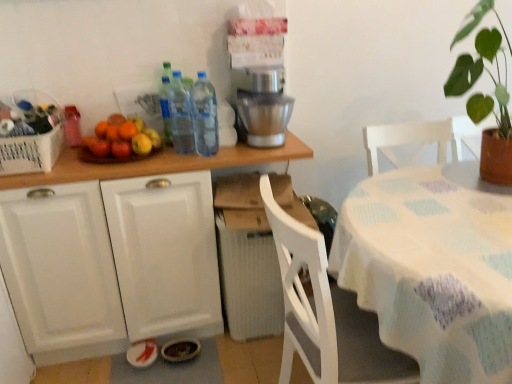
Question: Considering the relative positions of satin silver coffee machine at upper center and translucent plastic bottles at upper center, marked as the second bottle in a right-to-left arrangement, in the image provided, is satin silver coffee machine at upper center in front of translucent plastic bottles at upper center, marked as the second bottle in a right-to-left arrangement,?

Choices:
 (A) yes
 (B) no

Answer: (B)

Question: From a real-world perspective, does satin silver coffee machine at upper center stand above translucent plastic bottles at upper center, which is the second bottle in left-to-right order?

Choices:
 (A) yes
 (B) no

Answer: (B)

Question: Considering the relative positions of satin silver coffee machine at upper center and translucent plastic bottles at upper center, marked as the second bottle in a right-to-left arrangement, in the image provided, is satin silver coffee machine at upper center to the left of translucent plastic bottles at upper center, marked as the second bottle in a right-to-left arrangement, from the viewer's perspective?

Choices:
 (A) yes
 (B) no

Answer: (B)

Question: Is satin silver coffee machine at upper center wider than translucent plastic bottles at upper center, marked as the second bottle in a right-to-left arrangement?

Choices:
 (A) yes
 (B) no

Answer: (A)

Question: Would you say satin silver coffee machine at upper center is a long distance from translucent plastic bottles at upper center, which is the second bottle in left-to-right order?

Choices:
 (A) no
 (B) yes

Answer: (A)

Question: Does satin silver coffee machine at upper center come behind translucent plastic bottles at upper center, marked as the second bottle in a right-to-left arrangement?

Choices:
 (A) no
 (B) yes

Answer: (B)

Question: Is translucent plastic bottles at upper center, which is the second bottle in left-to-right order, outside of white fabric table at right?

Choices:
 (A) yes
 (B) no

Answer: (A)

Question: From the image's perspective, is translucent plastic bottles at upper center, which is the second bottle in left-to-right order, under white fabric table at right?

Choices:
 (A) yes
 (B) no

Answer: (B)

Question: Is translucent plastic bottles at upper center, which is the second bottle in left-to-right order, oriented away from white fabric table at right?

Choices:
 (A) no
 (B) yes

Answer: (A)

Question: Is translucent plastic bottles at upper center, marked as the second bottle in a right-to-left arrangement, shorter than white fabric table at right?

Choices:
 (A) yes
 (B) no

Answer: (A)

Question: Can you confirm if translucent plastic bottles at upper center, marked as the second bottle in a right-to-left arrangement, is bigger than white fabric table at right?

Choices:
 (A) no
 (B) yes

Answer: (A)

Question: Considering the relative positions of translucent plastic bottles at upper center, which is the second bottle in left-to-right order, and white fabric table at right in the image provided, is translucent plastic bottles at upper center, which is the second bottle in left-to-right order, to the right of white fabric table at right from the viewer's perspective?

Choices:
 (A) no
 (B) yes

Answer: (A)

Question: Can you see matte glass bottle at upper left, arranged as the 3th bottle when viewed from the right, touching white fabric table at right?

Choices:
 (A) no
 (B) yes

Answer: (A)